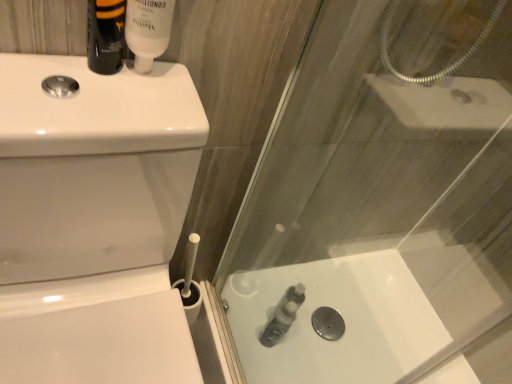
Where is `vacant point to the right of translucent plastic bottle at lower center, which is counted as the 3th toiletry, starting from the left`? The height and width of the screenshot is (384, 512). vacant point to the right of translucent plastic bottle at lower center, which is counted as the 3th toiletry, starting from the left is located at coordinates (307, 349).